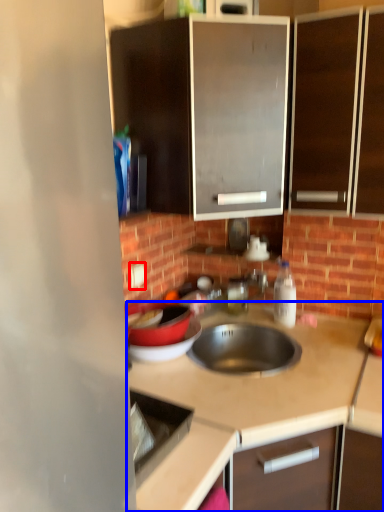
Question: Which object appears closest to the camera in this image, electric outlet (highlighted by a red box) or countertop (highlighted by a blue box)?

Choices:
 (A) electric outlet
 (B) countertop

Answer: (B)